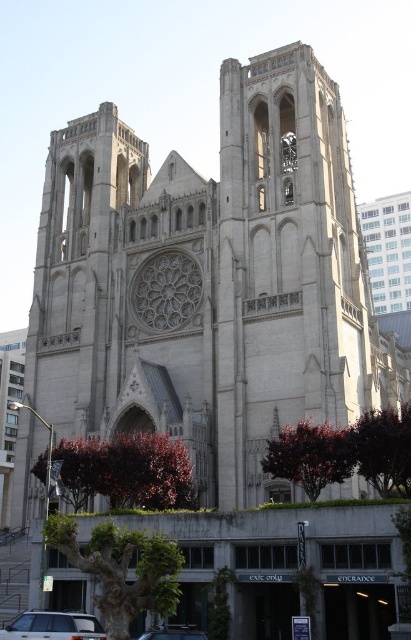
Where is `silver metallic suv at lower left`? This screenshot has width=411, height=640. silver metallic suv at lower left is located at coordinates (53, 627).

The width and height of the screenshot is (411, 640). What are the coordinates of `silver metallic suv at lower left` in the screenshot? It's located at (53, 627).